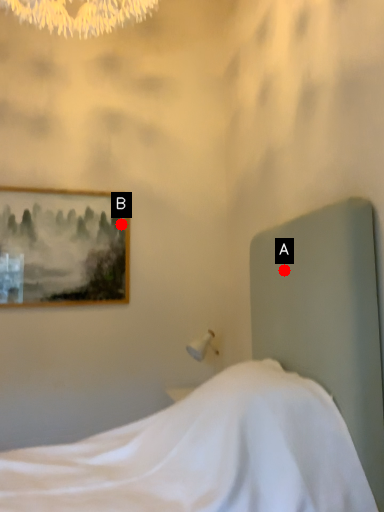
Question: Two points are circled on the image, labeled by A and B beside each circle. Which point is closer to the camera taking this photo?

Choices:
 (A) A is closer
 (B) B is closer

Answer: (A)